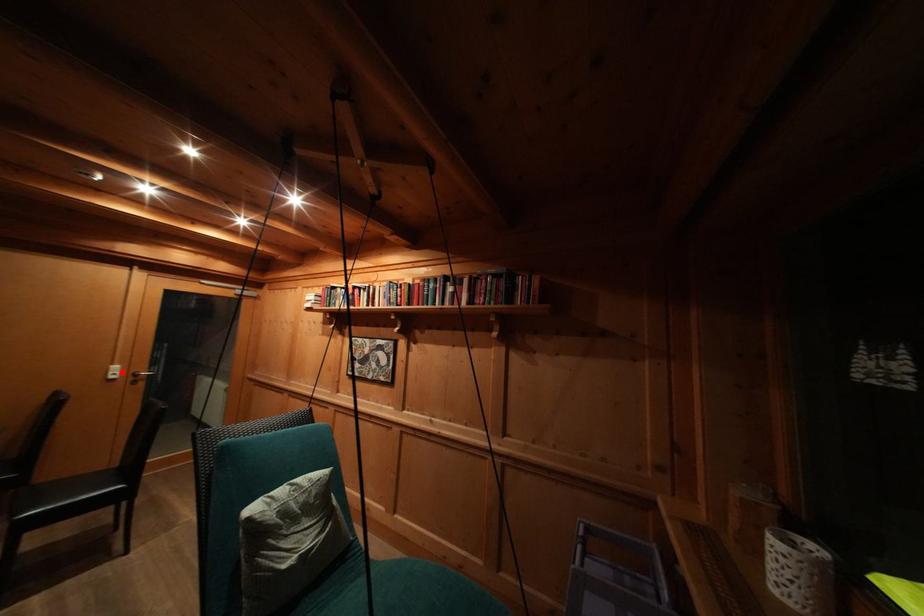
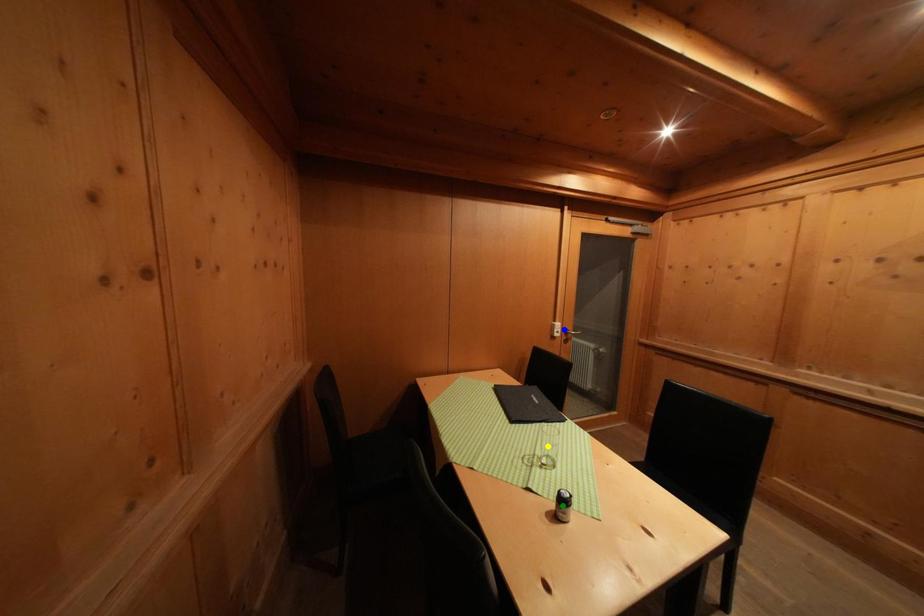
Question: I am providing you with two images of the same scene from different viewpoints. A red point is marked on the first image. You are given multiple points on the second image. Which spot in image 2 lines up with the point in image 1?

Choices:
 (A) yellow point
 (B) blue point
 (C) green point

Answer: (B)